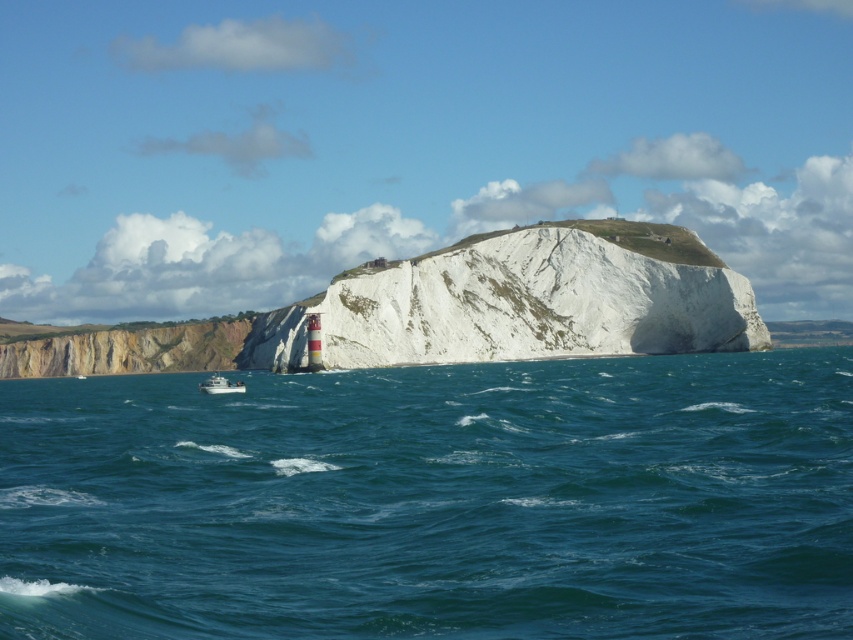
How far apart are blue water at center and yellowish rock cliff at lower left?

They are 171.87 feet apart.

Which is behind, point (281, 596) or point (202, 353)?

Point (202, 353)

What are the coordinates of `blue water at center` in the screenshot? It's located at (434, 500).

Between white rocky cliff at center and yellowish rock cliff at lower left, which one has more height?

white rocky cliff at center

Does white rocky cliff at center appear on the right side of yellowish rock cliff at lower left?

Indeed, white rocky cliff at center is positioned on the right side of yellowish rock cliff at lower left.

This screenshot has width=853, height=640. Identify the location of white rocky cliff at center. (523, 301).

Where is `white rocky cliff at center`? white rocky cliff at center is located at coordinates (523, 301).

Between point (776, 624) and point (236, 392), which one is positioned behind?

Point (236, 392)

Does blue water at center have a lesser height compared to white plastic boat at lower left?

In fact, blue water at center may be taller than white plastic boat at lower left.

Identify the location of blue water at center. Image resolution: width=853 pixels, height=640 pixels. (434, 500).

What are the coordinates of `blue water at center` in the screenshot? It's located at (434, 500).